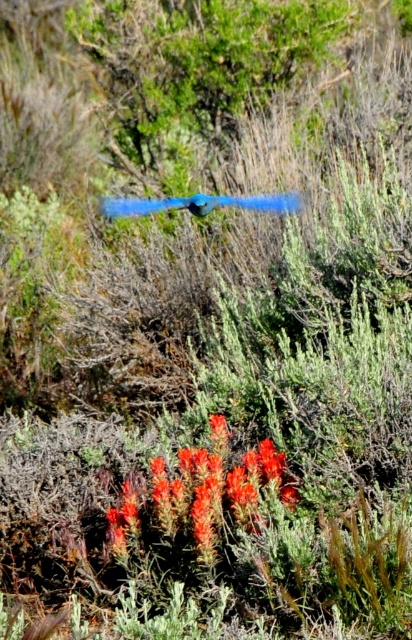
Based on the photo, you are a photographer aiming to capture both the bright orange textured flower at lower center and the blue feathered bird at center in a single frame. Based on their positions, will you need to adjust your camera angle upwards or downwards to include both subjects?

The bright orange textured flower at lower center is located below the blue feathered bird at center, so you will need to adjust your camera angle upwards to include both subjects in the frame.

You are an artist trying to paint the scene. You have a small brush that can only paint objects up to the size of the blue feathered bird at center. Can you paint the bright orange textured flower at lower center with this brush?

The bright orange textured flower at lower center is bigger than the blue feathered bird at center, so the small brush cannot paint it because it exceeds the brush size limit.